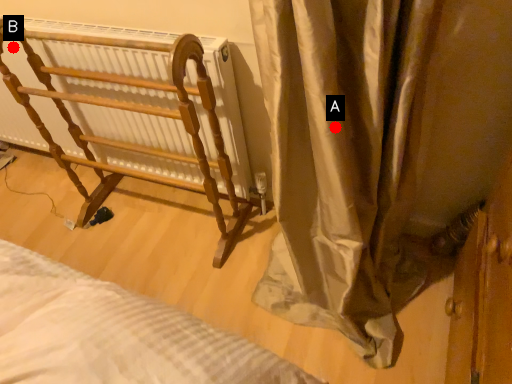
Question: Two points are circled on the image, labeled by A and B beside each circle. Which point is closer to the camera taking this photo?

Choices:
 (A) A is closer
 (B) B is closer

Answer: (A)